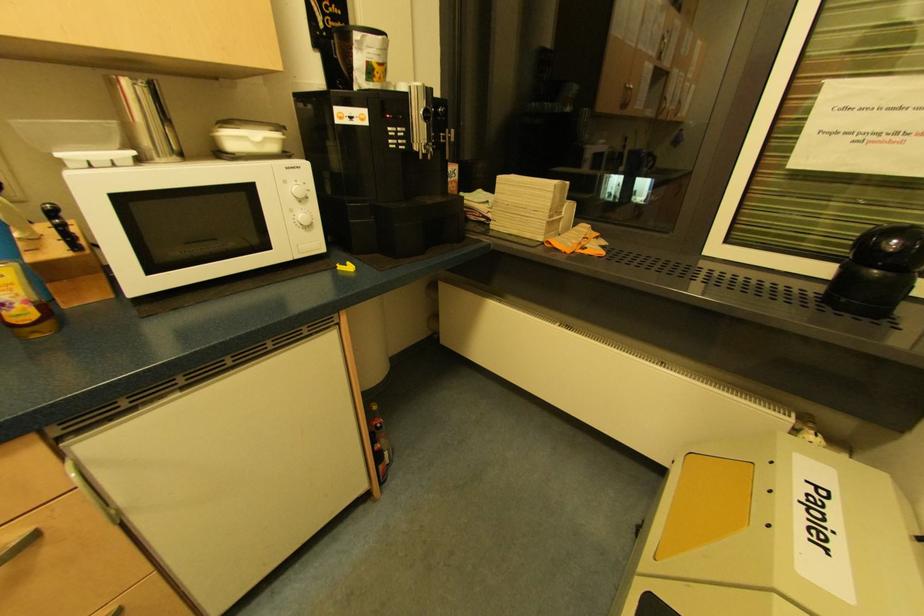
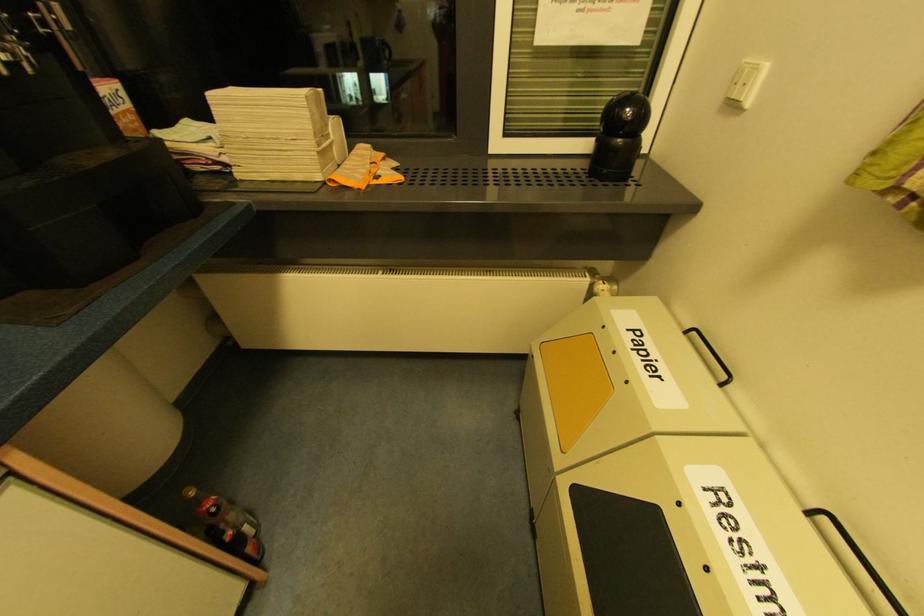
From the picture: How did the camera likely rotate?

The camera rotated toward right-down.